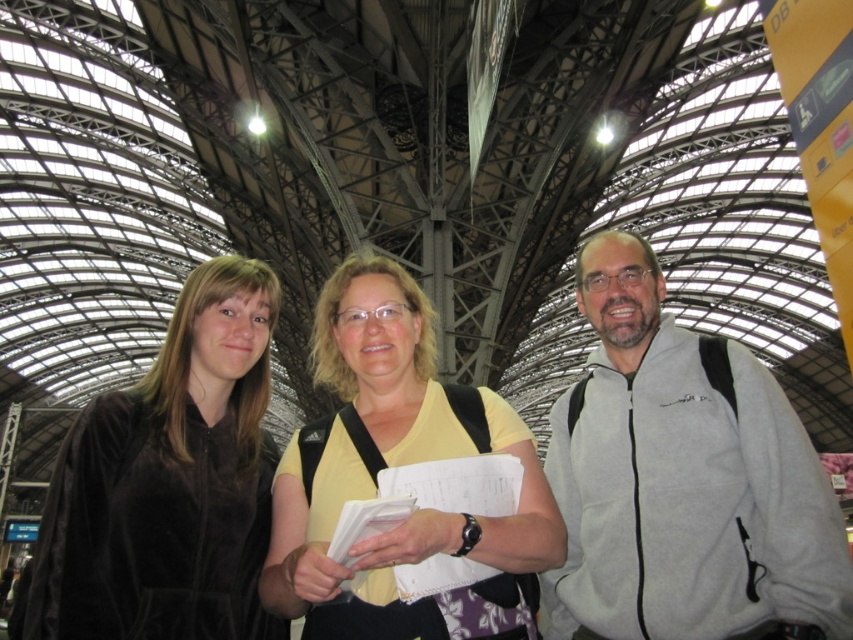
Can you confirm if velvet black jacket at left is positioned to the right of yellow cotton shirt at center?

In fact, velvet black jacket at left is to the left of yellow cotton shirt at center.

Which is behind, point (68, 561) or point (433, 400)?

The point (433, 400) is more distant.

Image resolution: width=853 pixels, height=640 pixels. I want to click on velvet black jacket at left, so tap(167, 483).

Does gray fleece jacket at right appear over velvet black jacket at left?

Actually, gray fleece jacket at right is below velvet black jacket at left.

Which is above, gray fleece jacket at right or velvet black jacket at left?

velvet black jacket at left is higher up.

Which is in front, point (560, 467) or point (86, 620)?

Point (86, 620) is in front.

This screenshot has height=640, width=853. What are the coordinates of `gray fleece jacket at right` in the screenshot? It's located at (683, 480).

Does gray fleece jacket at right have a lesser width compared to yellow cotton shirt at center?

Correct, gray fleece jacket at right's width is less than yellow cotton shirt at center's.

Does gray fleece jacket at right have a smaller size compared to yellow cotton shirt at center?

Correct, gray fleece jacket at right occupies less space than yellow cotton shirt at center.

Where is `gray fleece jacket at right`? gray fleece jacket at right is located at coordinates (683, 480).